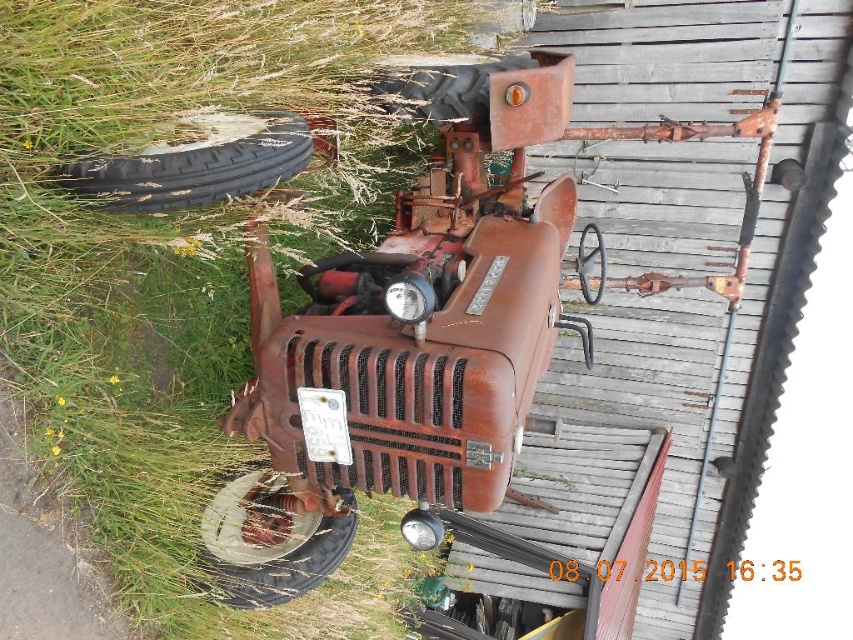
Question: From the image, what is the correct spatial relationship of green grass at upper left in relation to rusty metal tire at center?

Choices:
 (A) left
 (B) right

Answer: (A)

Question: Which of the following is the closest to the observer?

Choices:
 (A) rusty metal tire at lower left
 (B) rusty metal tire at center
 (C) black rubber tire at left
 (D) green grass at upper left

Answer: (D)

Question: Which object is closer to the camera taking this photo?

Choices:
 (A) black rubber tire at left
 (B) rusty metal tire at center
 (C) green grass at upper left
 (D) rusty metal tire at lower left

Answer: (C)

Question: Is black rubber tire at left in front of rusty metal tire at center?

Choices:
 (A) yes
 (B) no

Answer: (A)

Question: Where is black rubber tire at left located in relation to rusty metal tire at center in the image?

Choices:
 (A) left
 (B) right

Answer: (A)

Question: Which of the following is the farthest from the observer?

Choices:
 (A) (483, 90)
 (B) (206, 563)

Answer: (A)